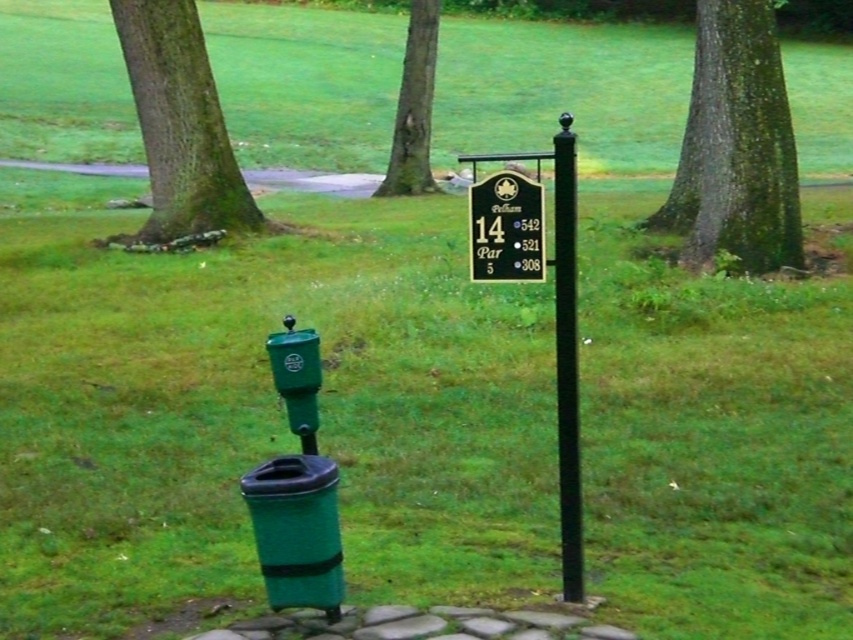
Is green mossy bark tree at upper right wider than black polished pole at center?

Yes.

Based on the photo, who is more forward, (677, 164) or (567, 344)?

Point (567, 344) is more forward.

Does point (706, 250) come farther from viewer compared to point (561, 358)?

Yes, it is behind point (561, 358).

You are a GUI agent. You are given a task and a screenshot of the screen. Output one action in this format:
    pyautogui.click(x=<x>, y=<y>)
    Task: Click on the green mossy bark tree at upper right
    The image size is (853, 640).
    Given the screenshot: What is the action you would take?
    pyautogui.click(x=735, y=147)

Is black polished pole at center positioned before black polished wood sign at center?

No, it is not.

Can you confirm if black polished pole at center is positioned below black polished wood sign at center?

Yes, black polished pole at center is below black polished wood sign at center.

The width and height of the screenshot is (853, 640). What do you see at coordinates (566, 362) in the screenshot?
I see `black polished pole at center` at bounding box center [566, 362].

Find the location of `black polished pole at center`. black polished pole at center is located at coordinates (566, 362).

Does green mossy tree at upper left have a lesser width compared to black polished wood sign at center?

In fact, green mossy tree at upper left might be wider than black polished wood sign at center.

Can you confirm if green mossy tree at upper left is positioned to the right of black polished wood sign at center?

In fact, green mossy tree at upper left is to the left of black polished wood sign at center.

The width and height of the screenshot is (853, 640). Identify the location of green mossy tree at upper left. (180, 124).